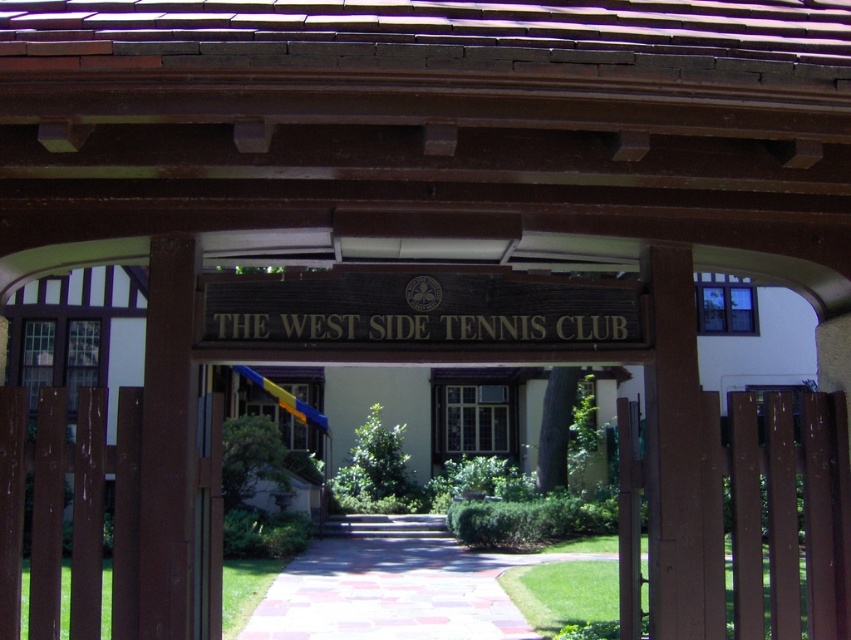
Question: Can you confirm if brown polished wood sign at center is positioned to the right of clear glass window at center?

Choices:
 (A) no
 (B) yes

Answer: (A)

Question: Does brown polished wood sign at center appear under clear glass window at center?

Choices:
 (A) no
 (B) yes

Answer: (A)

Question: Among these objects, which one is nearest to the camera?

Choices:
 (A) brown polished wood sign at center
 (B) clear glass window at center

Answer: (A)

Question: Does brown polished wood sign at center have a lesser width compared to clear glass window at center?

Choices:
 (A) yes
 (B) no

Answer: (A)